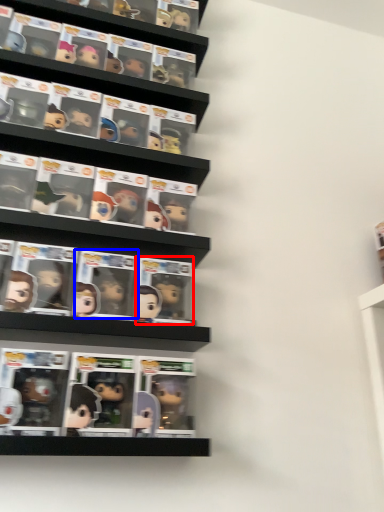
Question: Which object is further to the camera taking this photo, comic book (highlighted by a red box) or comic book (highlighted by a blue box)?

Choices:
 (A) comic book
 (B) comic book

Answer: (A)